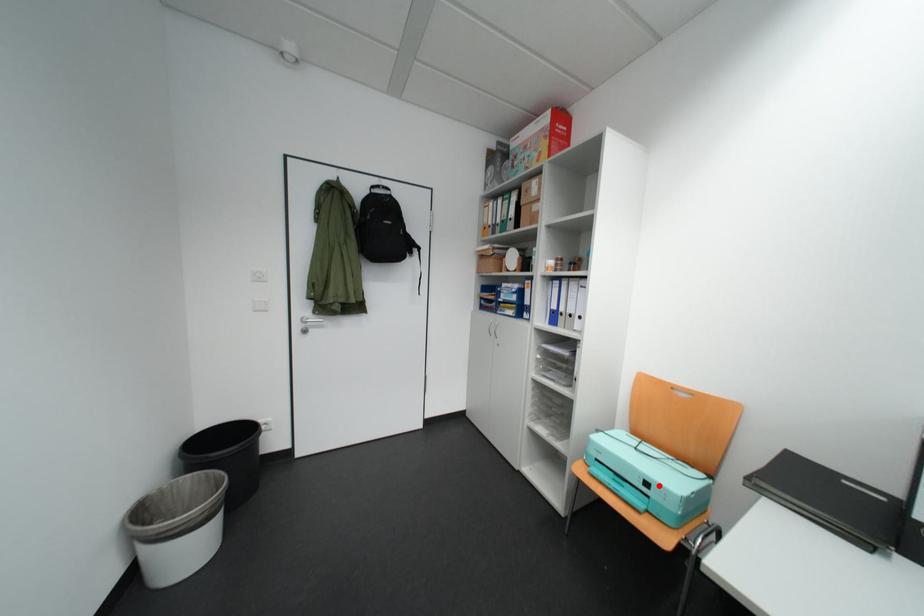
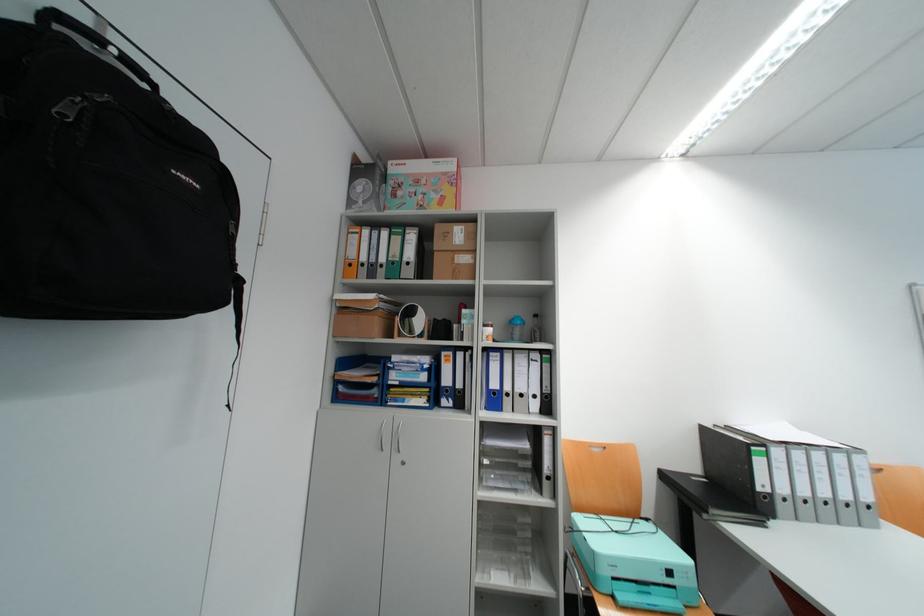
Question: I am providing you with two images of the same scene from different viewpoints. Given a red point in image1, look at the same physical point in image2. Is it:

Choices:
 (A) Closer to the viewpoint
 (B) Farther from the viewpoint

Answer: (A)